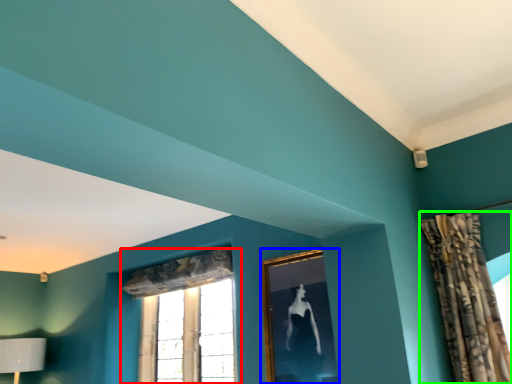
Question: Estimate the real-world distances between objects in this image. Which object is farther from window (highlighted by a red box), picture frame (highlighted by a blue box) or curtain (highlighted by a green box)?

Choices:
 (A) picture frame
 (B) curtain

Answer: (B)